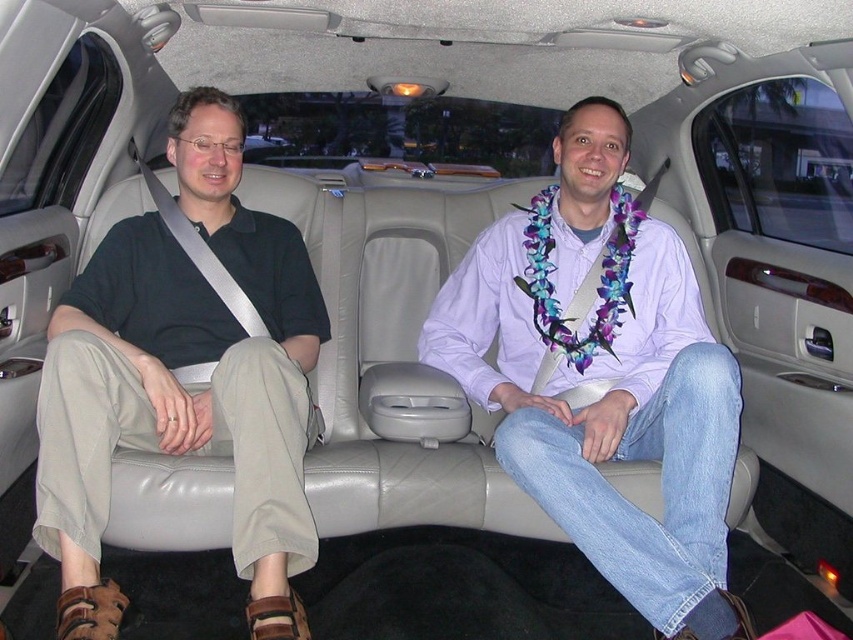
Question: Which object is closer to the camera taking this photo?

Choices:
 (A) dark green polo shirt at left
 (B) light purple shirt at center

Answer: (A)

Question: From the image, what is the correct spatial relationship of light purple shirt at center in relation to dark green polo shirt at left?

Choices:
 (A) below
 (B) above

Answer: (A)

Question: Which point is farther to the camera?

Choices:
 (A) dark green polo shirt at left
 (B) light purple shirt at center

Answer: (B)

Question: Can you confirm if light purple shirt at center is bigger than dark green polo shirt at left?

Choices:
 (A) yes
 (B) no

Answer: (A)

Question: Is light purple shirt at center wider than dark green polo shirt at left?

Choices:
 (A) no
 (B) yes

Answer: (B)